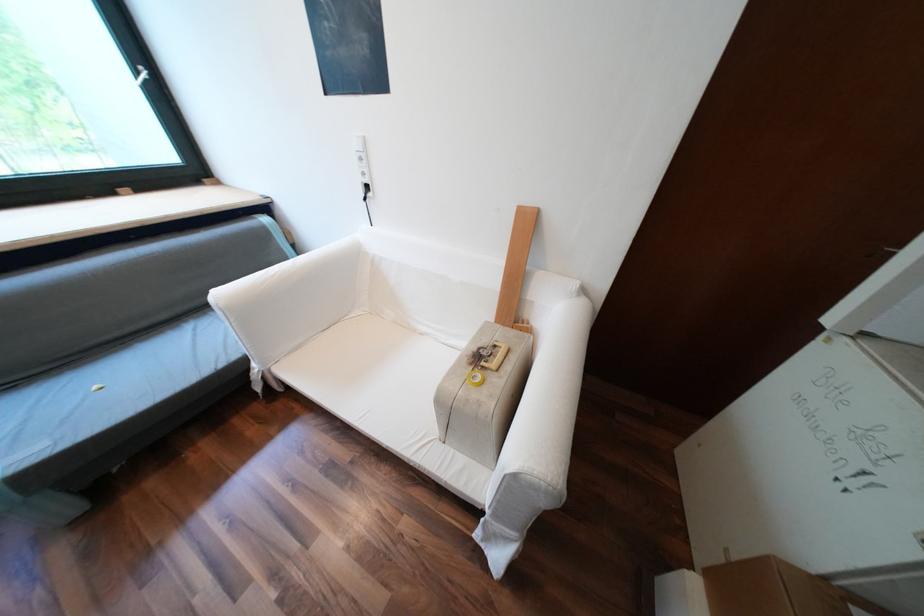
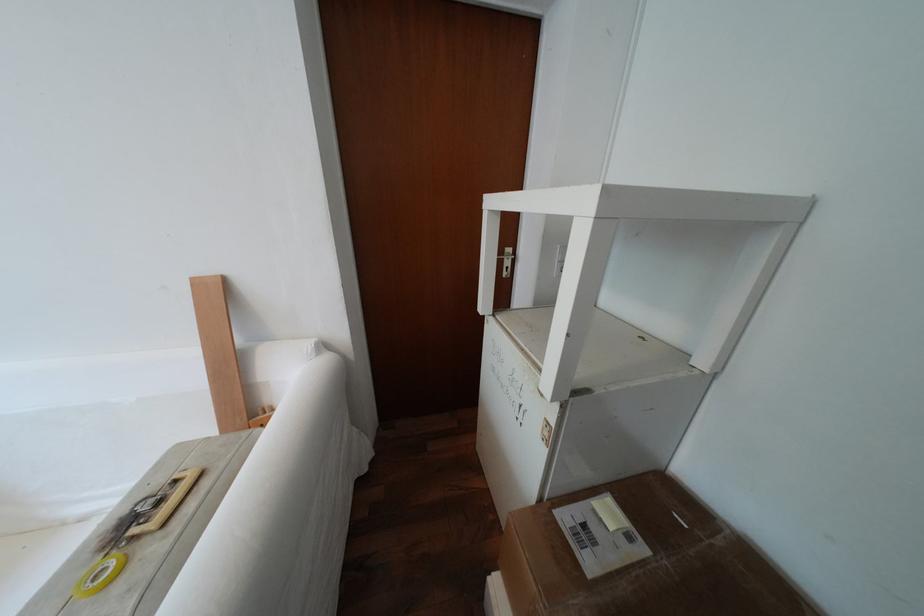
Question: The camera is either moving clockwise (left) or counter-clockwise (right) around the object. The first image is from the beginning of the video and the second image is from the end. Is the camera moving left or right when shooting the video?

Choices:
 (A) Left
 (B) Right

Answer: (A)